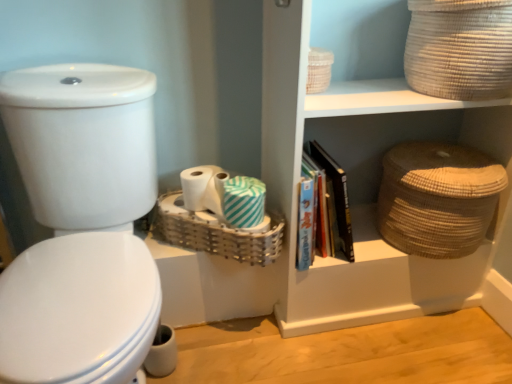
Question: Considering their positions, is white glossy toilet at left located in front of or behind brown woven basket at right, which is counted as the 1th basket, starting from the right?

Choices:
 (A) behind
 (B) front

Answer: (B)

Question: Does point (155, 188) appear closer or farther from the camera than point (443, 251)?

Choices:
 (A) farther
 (B) closer

Answer: (B)

Question: Considering the real-world distances, which object is closest to the white paper roll at center?

Choices:
 (A) white striped toilet paper at center, which is the second toilet paper in right-to-left order
 (B) woven beige basket at upper right, which appears as the 2th basket when viewed from the right
 (C) natural woven basket at upper right
 (D) brown woven basket at right, positioned as the third basket in left-to-right order
 (E) woven wicker basket at center, the 1th basket when ordered from left to right

Answer: (A)

Question: Which is nearer to the teal striped toilet paper at center, which is the second toilet paper in left-to-right order?

Choices:
 (A) natural woven basket at upper right
 (B) white glossy toilet at left
 (C) brown woven basket at right, positioned as the third basket in left-to-right order
 (D) white paper roll at center
 (E) woven beige basket at upper right, which appears as the 2th basket when viewed from the right

Answer: (D)